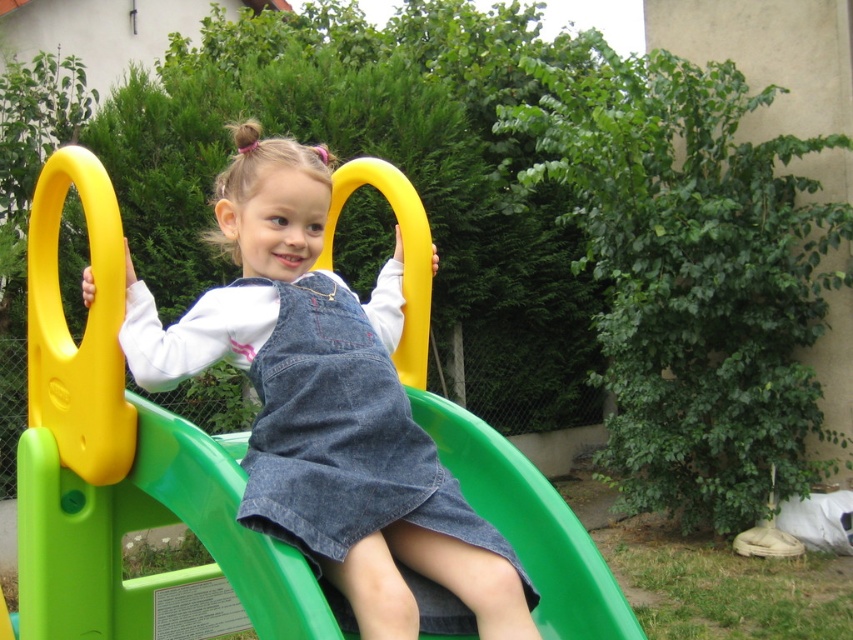
Which is below, denim overalls at center or denim dress at center?

denim dress at center is below.

Does point (506, 605) come closer to viewer compared to point (474, 630)?

Yes, point (506, 605) is in front of point (474, 630).

Between point (456, 492) and point (293, 445), which one is positioned behind?

Point (456, 492)

You are a GUI agent. You are given a task and a screenshot of the screen. Output one action in this format:
    pyautogui.click(x=<x>, y=<y>)
    Task: Click on the denim overalls at center
    
    Given the screenshot: What is the action you would take?
    pyautogui.click(x=329, y=412)